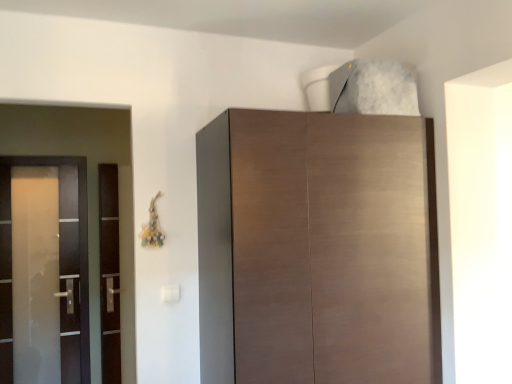
Question: Is matte brown cabinet at upper center shorter than satin glass screen door at left, positioned as the first screen door in left-to-right order?

Choices:
 (A) no
 (B) yes

Answer: (B)

Question: Is matte brown cabinet at upper center at the right side of satin glass screen door at left, positioned as the first screen door in left-to-right order?

Choices:
 (A) no
 (B) yes

Answer: (B)

Question: Is the surface of matte brown cabinet at upper center in direct contact with satin glass screen door at left, marked as the 2th screen door in a right-to-left arrangement?

Choices:
 (A) no
 (B) yes

Answer: (A)

Question: Considering the relative positions of matte brown cabinet at upper center and satin glass screen door at left, marked as the 2th screen door in a right-to-left arrangement, in the image provided, is matte brown cabinet at upper center to the left of satin glass screen door at left, marked as the 2th screen door in a right-to-left arrangement, from the viewer's perspective?

Choices:
 (A) yes
 (B) no

Answer: (B)

Question: Is satin glass screen door at left, marked as the 2th screen door in a right-to-left arrangement, a part of matte brown cabinet at upper center?

Choices:
 (A) yes
 (B) no

Answer: (B)

Question: From the image's perspective, is matte brown cabinet at upper center on top of satin glass screen door at left, marked as the 2th screen door in a right-to-left arrangement?

Choices:
 (A) no
 (B) yes

Answer: (B)

Question: From a real-world perspective, is satin glass screen door at left, marked as the 2th screen door in a right-to-left arrangement, positioned under transparent glass door at left, which is the 1th screen door in right-to-left order, based on gravity?

Choices:
 (A) yes
 (B) no

Answer: (B)

Question: Is the depth of satin glass screen door at left, positioned as the first screen door in left-to-right order, greater than that of transparent glass door at left, which is the 1th screen door in right-to-left order?

Choices:
 (A) no
 (B) yes

Answer: (A)

Question: Considering the relative positions of satin glass screen door at left, positioned as the first screen door in left-to-right order, and transparent glass door at left, which is counted as the 2th screen door, starting from the left, in the image provided, is satin glass screen door at left, positioned as the first screen door in left-to-right order, to the right of transparent glass door at left, which is counted as the 2th screen door, starting from the left, from the viewer's perspective?

Choices:
 (A) yes
 (B) no

Answer: (B)

Question: Is satin glass screen door at left, marked as the 2th screen door in a right-to-left arrangement, not close to transparent glass door at left, which is counted as the 2th screen door, starting from the left?

Choices:
 (A) yes
 (B) no

Answer: (B)

Question: Considering the relative sizes of satin glass screen door at left, marked as the 2th screen door in a right-to-left arrangement, and transparent glass door at left, which is counted as the 2th screen door, starting from the left, in the image provided, is satin glass screen door at left, marked as the 2th screen door in a right-to-left arrangement, smaller than transparent glass door at left, which is counted as the 2th screen door, starting from the left,?

Choices:
 (A) no
 (B) yes

Answer: (B)

Question: Is satin glass screen door at left, positioned as the first screen door in left-to-right order, closer to the viewer compared to transparent glass door at left, which is the 1th screen door in right-to-left order?

Choices:
 (A) yes
 (B) no

Answer: (A)

Question: From the image's perspective, does transparent glass door at left, which is the 1th screen door in right-to-left order, appear lower than matte brown cabinet at upper center?

Choices:
 (A) no
 (B) yes

Answer: (B)